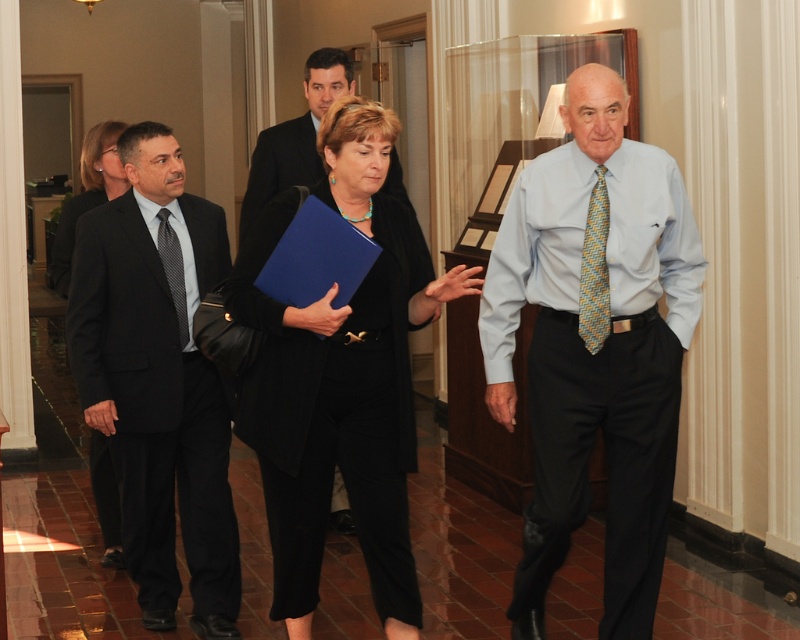
Is light blue shirt at center to the left of black textured tie at left from the viewer's perspective?

No, light blue shirt at center is not to the left of black textured tie at left.

Does light blue shirt at center have a greater width compared to black textured tie at left?

Yes.

Is point (498, 336) positioned in front of point (169, 237)?

Yes.

At what (x,y) coordinates should I click in order to perform the action: click on light blue shirt at center. Please return your answer as a coordinate pair (x, y). Looking at the image, I should click on (596, 346).

Can you confirm if matte black suit at left is shorter than yellow-green woven tie at center-right?

In fact, matte black suit at left may be taller than yellow-green woven tie at center-right.

Does point (98, 225) come in front of point (604, 212)?

No, it is behind (604, 212).

Which is in front, point (80, 372) or point (596, 305)?

Point (596, 305) is in front.

The image size is (800, 640). In order to click on matte black suit at left in this screenshot , I will do `click(158, 380)`.

Who is more forward, (97, 460) or (590, 196)?

Point (590, 196) is in front.

Which is above, black fabric suit at left or yellow-green woven tie at center-right?

black fabric suit at left is above.

At what (x,y) coordinates should I click in order to perform the action: click on black fabric suit at left. Please return your answer as a coordinate pair (x, y). This screenshot has width=800, height=640. Looking at the image, I should click on (88, 195).